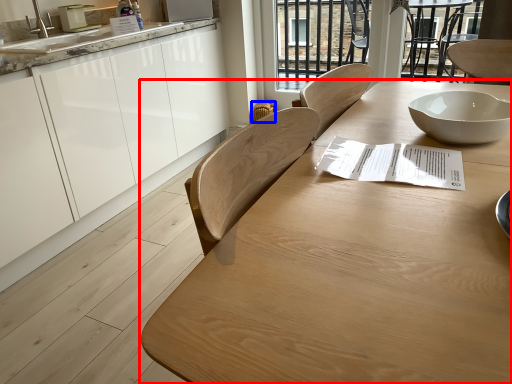
Question: Which object is closer to the camera taking this photo, table (highlighted by a red box) or chair (highlighted by a blue box)?

Choices:
 (A) table
 (B) chair

Answer: (A)